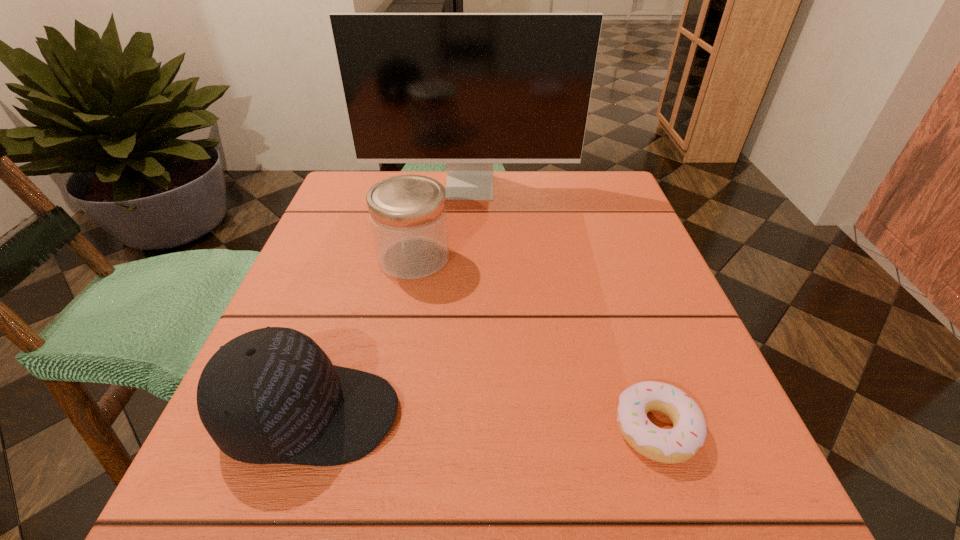
Locate an element on the screen. baseball cap at the near edge is located at coordinates (270, 396).

At what (x,y) coordinates should I click in order to perform the action: click on doughnut located in the near edge section of the desktop. Please return your answer as a coordinate pair (x, y). This screenshot has width=960, height=540. Looking at the image, I should click on (679, 444).

Image resolution: width=960 pixels, height=540 pixels. Identify the location of monitor that is at the left edge. (467, 89).

The height and width of the screenshot is (540, 960). What are the coordinates of `jar that is positioned at the left edge` in the screenshot? It's located at (408, 216).

You are a GUI agent. You are given a task and a screenshot of the screen. Output one action in this format:
    pyautogui.click(x=<x>, y=<y>)
    Task: Click on the baseball cap that is positioned at the left edge
    
    Given the screenshot: What is the action you would take?
    pyautogui.click(x=270, y=396)

Locate an element on the screen. The height and width of the screenshot is (540, 960). monitor present at the right edge is located at coordinates (467, 89).

At what (x,y) coordinates should I click in order to perform the action: click on doughnut positioned at the right edge. Please return your answer as a coordinate pair (x, y). Image resolution: width=960 pixels, height=540 pixels. Looking at the image, I should click on (679, 444).

What are the coordinates of `object present at the far left corner` in the screenshot? It's located at (467, 89).

The image size is (960, 540). Identify the location of object present at the near left corner. (270, 396).

Image resolution: width=960 pixels, height=540 pixels. Identify the location of object that is at the far right corner. (467, 89).